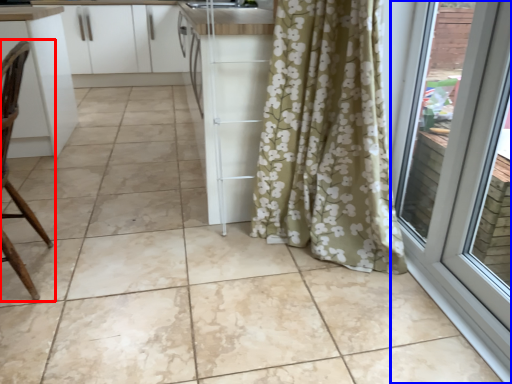
Question: Which object is further to the camera taking this photo, chair (highlighted by a red box) or door (highlighted by a blue box)?

Choices:
 (A) chair
 (B) door

Answer: (A)